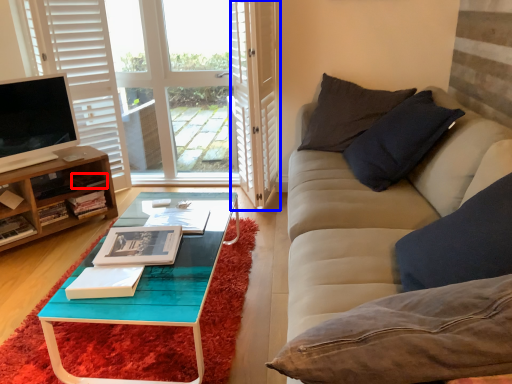
Question: Which of the following is the closest to the observer, book (highlighted by a red box) or screen door (highlighted by a blue box)?

Choices:
 (A) book
 (B) screen door

Answer: (B)